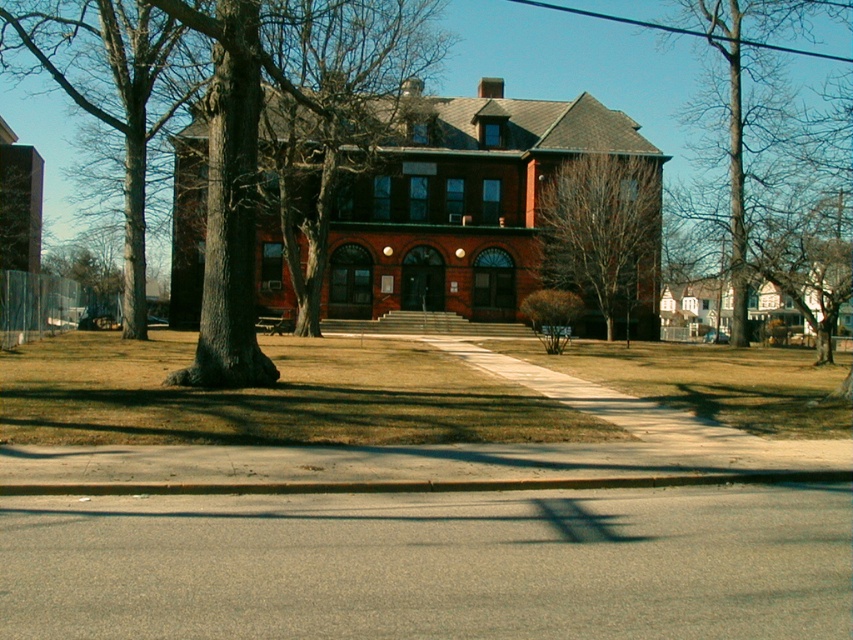
The width and height of the screenshot is (853, 640). In order to click on dark brown bark tree at center in this screenshot , I will do `click(231, 182)`.

Describe the element at coordinates (231, 182) in the screenshot. The width and height of the screenshot is (853, 640). I see `dark brown bark tree at center` at that location.

Find the location of `dark brown bark tree at center`. dark brown bark tree at center is located at coordinates (231, 182).

Measure the distance from brown bark tree at left to bare branches at right.

71.90 feet

Is brown bark tree at left to the right of bare branches at right from the viewer's perspective?

In fact, brown bark tree at left is to the left of bare branches at right.

This screenshot has height=640, width=853. I want to click on brown bark tree at left, so click(114, 90).

Can you confirm if brown bark tree at left is positioned to the left of bare wood tree at upper right?

Yes, brown bark tree at left is to the left of bare wood tree at upper right.

The image size is (853, 640). What do you see at coordinates (114, 90) in the screenshot? I see `brown bark tree at left` at bounding box center [114, 90].

What do you see at coordinates (114, 90) in the screenshot?
I see `brown bark tree at left` at bounding box center [114, 90].

This screenshot has width=853, height=640. I want to click on brown bark tree at left, so click(114, 90).